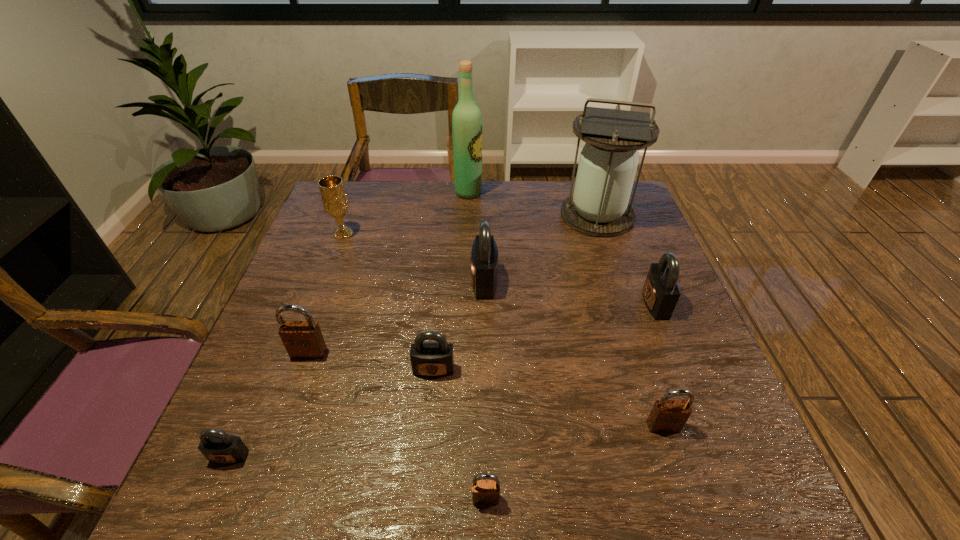
In order to click on vacant space located on the front of the tallest padlock near the keyhole in this screenshot , I will do `click(333, 282)`.

The height and width of the screenshot is (540, 960). What are the coordinates of `free location located on the front of the tallest padlock near the keyhole` in the screenshot? It's located at (322, 282).

This screenshot has width=960, height=540. I want to click on blank space located 0.250m on the back of the chalice, so pos(363,183).

Where is `vacant space located on the front of the third smallest gray padlock near the keyhole`? This screenshot has width=960, height=540. vacant space located on the front of the third smallest gray padlock near the keyhole is located at coordinates (619, 303).

You are a GUI agent. You are given a task and a screenshot of the screen. Output one action in this format:
    pyautogui.click(x=<x>, y=<y>)
    Task: Click on the vacant space situated 0.320m on the front of the third smallest gray padlock near the keyhole
    
    Given the screenshot: What is the action you would take?
    pyautogui.click(x=512, y=303)

Where is `vacant space located 0.360m on the front of the third smallest gray padlock near the keyhole`? The image size is (960, 540). vacant space located 0.360m on the front of the third smallest gray padlock near the keyhole is located at coordinates (494, 303).

Where is `free spot located on the front-facing side of the farthest brown padlock`? free spot located on the front-facing side of the farthest brown padlock is located at coordinates pos(300,379).

Where is `free location located 0.070m on the front-facing side of the second padlock from right to left`? This screenshot has width=960, height=540. free location located 0.070m on the front-facing side of the second padlock from right to left is located at coordinates (678, 470).

At what (x,y) coordinates should I click in order to perform the action: click on vacant region located on the front of the fourth nearest padlock near the keyhole. Please return your answer as a coordinate pair (x, y). The image size is (960, 540). Looking at the image, I should click on (430, 414).

Where is `vacant space situated on the front of the second nearest object near the keyhole`? vacant space situated on the front of the second nearest object near the keyhole is located at coordinates (213, 495).